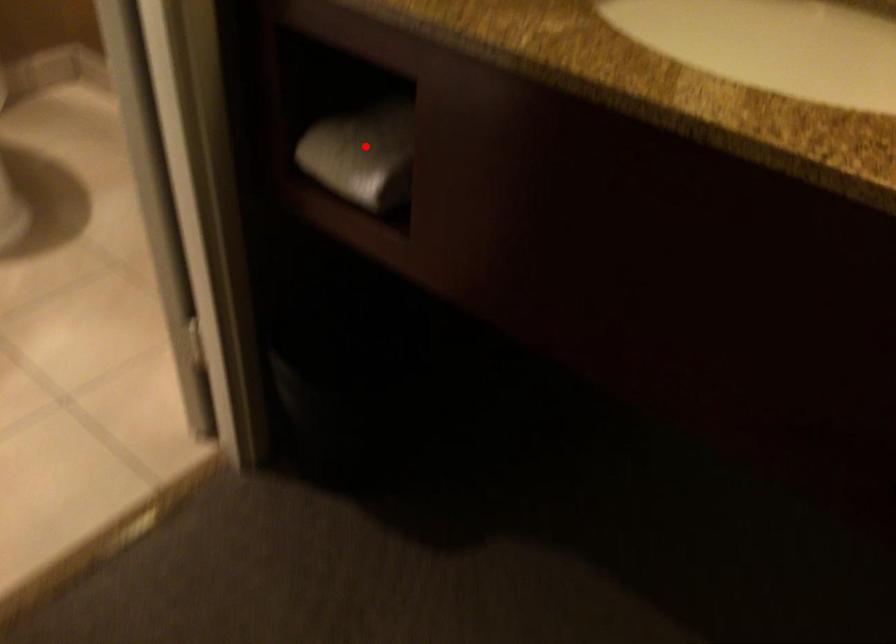
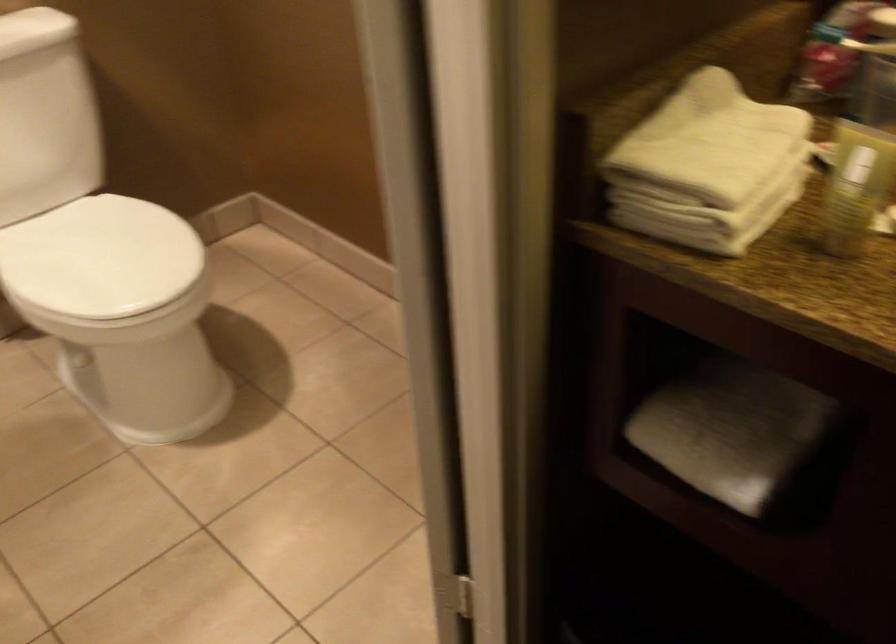
Question: I am providing you with two images of the same scene from different viewpoints. Image1 has a red point marked. In image2, the corresponding 3D location appears at what relative position? Reply with the corresponding letter.

Choices:
 (A) Closer
 (B) Farther

Answer: (A)